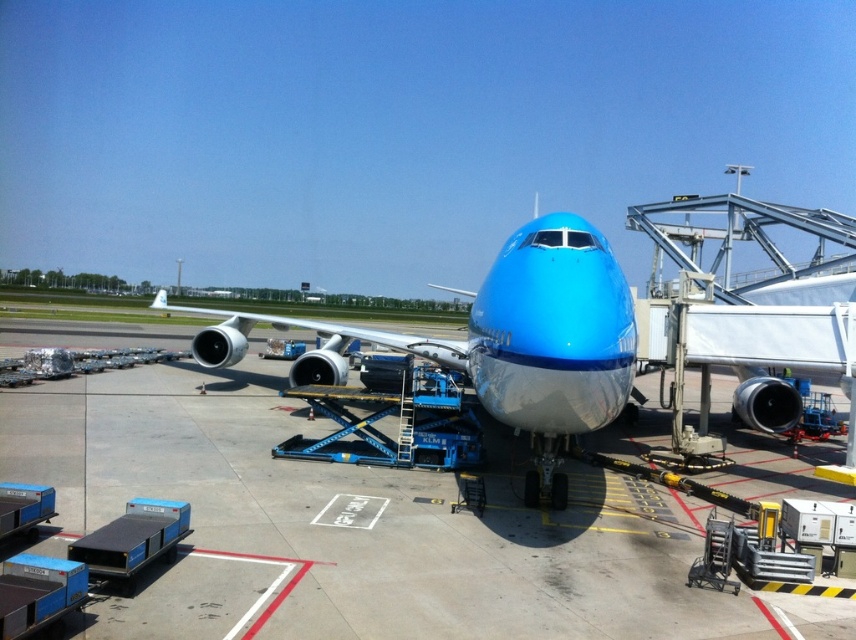
Question: Among these points, which one is farthest from the camera?

Choices:
 (A) (111, 502)
 (B) (744, 212)

Answer: (B)

Question: Is matte gray tarmac at center thinner than matte blue airplane at center?

Choices:
 (A) no
 (B) yes

Answer: (A)

Question: Which point is farther from the camera taking this photo?

Choices:
 (A) (556, 284)
 (B) (346, 468)

Answer: (B)

Question: Does matte gray tarmac at center appear on the right side of matte blue airplane at center?

Choices:
 (A) yes
 (B) no

Answer: (B)

Question: Is matte gray tarmac at center to the right of matte blue airplane at center from the viewer's perspective?

Choices:
 (A) no
 (B) yes

Answer: (A)